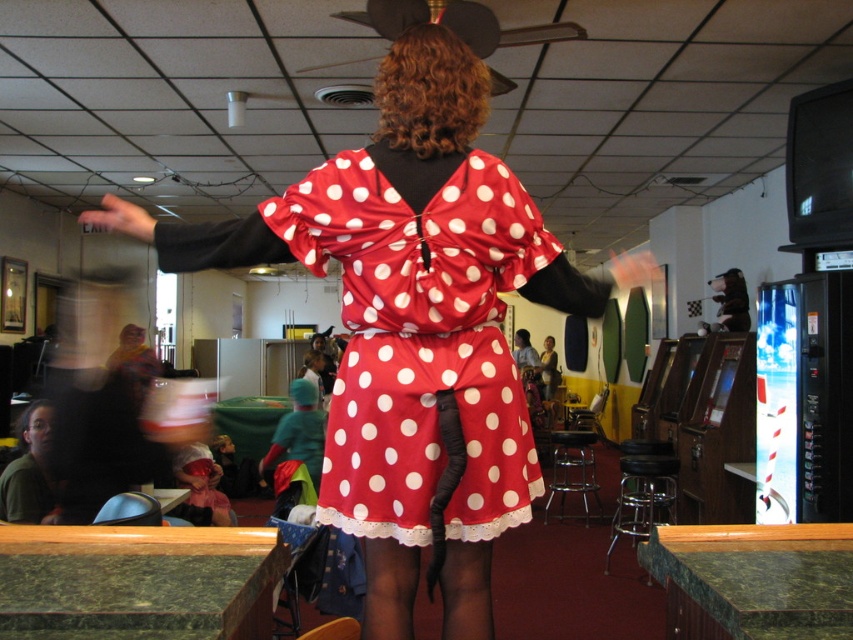
Question: Which of the following is the farthest from the observer?

Choices:
 (A) (22, 467)
 (B) (497, 326)

Answer: (A)

Question: Can you confirm if silky red dress at center is positioned to the left of green matte shirt at lower left?

Choices:
 (A) yes
 (B) no

Answer: (B)

Question: Can you confirm if silky red dress at center is positioned to the left of green matte shirt at lower left?

Choices:
 (A) no
 (B) yes

Answer: (A)

Question: Considering the relative positions of silky red dress at center and green matte shirt at lower left in the image provided, where is silky red dress at center located with respect to green matte shirt at lower left?

Choices:
 (A) above
 (B) below

Answer: (A)